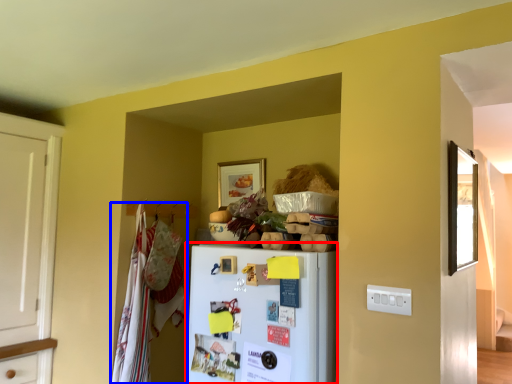
Question: Which object appears closest to the camera in this image, refrigerator (highlighted by a red box) or laundry (highlighted by a blue box)?

Choices:
 (A) refrigerator
 (B) laundry

Answer: (A)